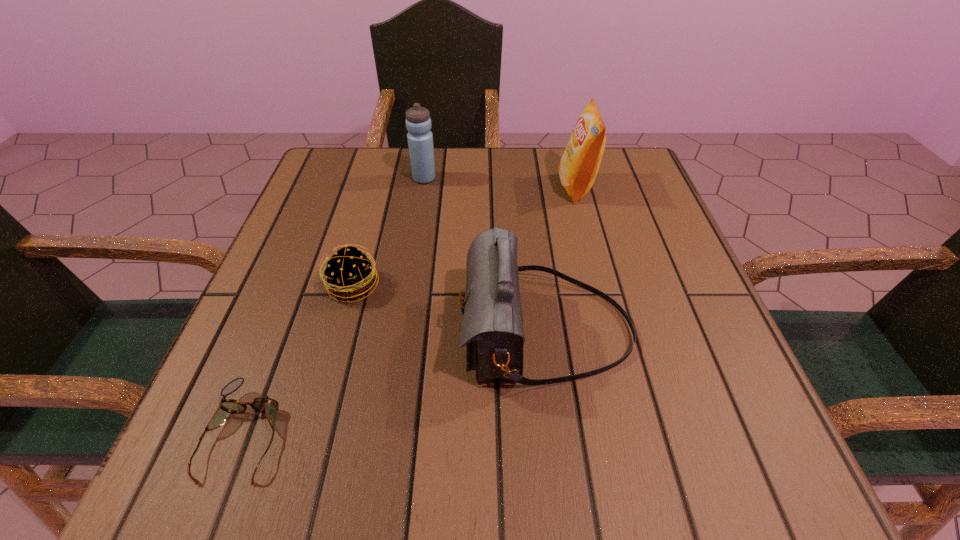
The width and height of the screenshot is (960, 540). I want to click on crisp (potato chip), so click(578, 167).

This screenshot has width=960, height=540. In order to click on the third object from right to left in this screenshot , I will do `click(420, 139)`.

This screenshot has height=540, width=960. I want to click on shoulder bag, so click(x=492, y=328).

You are a GUI agent. You are given a task and a screenshot of the screen. Output one action in this format:
    pyautogui.click(x=<x>, y=<y>)
    Task: Click on the patty
    The height and width of the screenshot is (540, 960).
    Given the screenshot: What is the action you would take?
    pyautogui.click(x=348, y=274)

Identify the location of the shortest object. (268, 406).

At what (x,y) coordinates should I click in order to perform the action: click on free space located on the front-facing side of the crisp (potato chip). Please return your answer as a coordinate pair (x, y). Looking at the image, I should click on (438, 187).

This screenshot has height=540, width=960. What are the coordinates of `vacant area located on the front-facing side of the crisp (potato chip)` in the screenshot? It's located at (537, 187).

At what (x,y) coordinates should I click in order to perform the action: click on blank space located on the front-facing side of the crisp (potato chip). Please return your answer as a coordinate pair (x, y). Looking at the image, I should click on (443, 187).

The width and height of the screenshot is (960, 540). I want to click on free space located on the right of the water bottle, so click(x=482, y=178).

I want to click on vacant position located 0.060m on the back of the shoulder bag, so click(x=536, y=254).